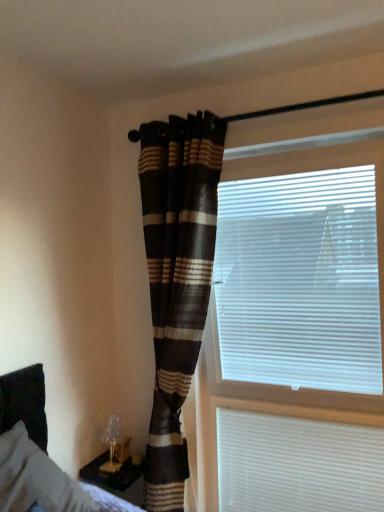
Measure the distance between plaid fabric curtain at center and camera.

plaid fabric curtain at center is 6.37 feet from camera.

Identify the location of white plastic blinds at lower right, the second window blind positioned from the top. (297, 464).

In order to click on gray fabric bed at lower left in this screenshot , I will do `click(38, 449)`.

I want to click on plaid fabric curtain at center, so click(177, 279).

From a real-world perspective, which object stands above the other?

gray fabric bed at lower left, from a real-world perspective.

From the image's perspective, which object appears higher, white plastic blinds at lower right, the second window blind positioned from the top, or gray fabric bed at lower left?

gray fabric bed at lower left.

Does white plastic blinds at lower right, the second window blind positioned from the top, have a smaller size compared to gray fabric bed at lower left?

Yes, white plastic blinds at lower right, the second window blind positioned from the top, is smaller than gray fabric bed at lower left.

Considering the sizes of white plastic blinds at lower right, the second window blind positioned from the top, and gray fabric bed at lower left in the image, is white plastic blinds at lower right, the second window blind positioned from the top, wider or thinner than gray fabric bed at lower left?

Considering their sizes, white plastic blinds at lower right, the second window blind positioned from the top, looks slimmer than gray fabric bed at lower left.

How much distance is there between gray fabric bed at lower left and white plastic blinds at right, which ranks as the first window blind in top-to-bottom order?

gray fabric bed at lower left and white plastic blinds at right, which ranks as the first window blind in top-to-bottom order, are 3.54 feet apart from each other.

From the picture: Is gray fabric bed at lower left situated inside white plastic blinds at right, which ranks as the first window blind in top-to-bottom order, or outside?

gray fabric bed at lower left is spatially situated outside white plastic blinds at right, which ranks as the first window blind in top-to-bottom order.

In the scene shown: Who is taller, gray fabric bed at lower left or white plastic blinds at right, which ranks as the first window blind in top-to-bottom order?

Standing taller between the two is white plastic blinds at right, which ranks as the first window blind in top-to-bottom order.

Could you tell me if gray fabric bed at lower left is facing white plastic blinds at right, which ranks as the first window blind in top-to-bottom order?

No.

Is gray fabric bed at lower left not within white plastic blinds at lower right, the second window blind positioned from the top?

Yes, gray fabric bed at lower left is not within white plastic blinds at lower right, the second window blind positioned from the top.

The width and height of the screenshot is (384, 512). I want to click on window blind that appears below the gray fabric bed at lower left (from the image's perspective), so coord(297,464).

Which object is wider, gray fabric bed at lower left or white plastic blinds at lower right, arranged as the 1th window blind when ordered from the bottom?

gray fabric bed at lower left.

Considering the positions of point (7, 416) and point (243, 429), is point (7, 416) closer or farther from the camera than point (243, 429)?

Point (7, 416).

Which of these two, white plastic blinds at lower right, the second window blind positioned from the top, or plaid fabric curtain at center, is bigger?

plaid fabric curtain at center is bigger.

From the image's perspective, is white plastic blinds at lower right, arranged as the 1th window blind when ordered from the bottom, under plaid fabric curtain at center?

Indeed, from the image's perspective, white plastic blinds at lower right, arranged as the 1th window blind when ordered from the bottom, is shown beneath plaid fabric curtain at center.

Choose the correct answer: Is white plastic blinds at lower right, the second window blind positioned from the top, inside plaid fabric curtain at center or outside it?

white plastic blinds at lower right, the second window blind positioned from the top, is not enclosed by plaid fabric curtain at center.

Can you see white plastic blinds at lower right, the second window blind positioned from the top, touching plaid fabric curtain at center?

white plastic blinds at lower right, the second window blind positioned from the top, and plaid fabric curtain at center are not in contact.

From a real-world perspective, between plaid fabric curtain at center and white plastic blinds at right, which is the 2th window blind in bottom-to-top order, who is vertically lower?

plaid fabric curtain at center.

Who is smaller, plaid fabric curtain at center or white plastic blinds at right, which is the 2th window blind in bottom-to-top order?

Smaller between the two is white plastic blinds at right, which is the 2th window blind in bottom-to-top order.

Is plaid fabric curtain at center at the left side of white plastic blinds at right, which ranks as the first window blind in top-to-bottom order?

Correct, you'll find plaid fabric curtain at center to the left of white plastic blinds at right, which ranks as the first window blind in top-to-bottom order.

Is plaid fabric curtain at center shorter than white plastic blinds at right, which is the 2th window blind in bottom-to-top order?

No.

Is white plastic blinds at right, which is the 2th window blind in bottom-to-top order, aimed at white plastic blinds at lower right, the second window blind positioned from the top?

No, white plastic blinds at right, which is the 2th window blind in bottom-to-top order, is not facing towards white plastic blinds at lower right, the second window blind positioned from the top.

From the image's perspective, is white plastic blinds at right, which is the 2th window blind in bottom-to-top order, under white plastic blinds at lower right, the second window blind positioned from the top?

No, from the image's perspective, white plastic blinds at right, which is the 2th window blind in bottom-to-top order, is not below white plastic blinds at lower right, the second window blind positioned from the top.

Which is closer, (266,375) or (297,450)?

Clearly, point (266,375) is more distant from the camera than point (297,450).

Could you measure the distance between plaid fabric curtain at center and white plastic blinds at lower right, the second window blind positioned from the top?

The distance of plaid fabric curtain at center from white plastic blinds at lower right, the second window blind positioned from the top, is 64.98 centimeters.

Does plaid fabric curtain at center turn towards white plastic blinds at lower right, the second window blind positioned from the top?

No, plaid fabric curtain at center is not oriented towards white plastic blinds at lower right, the second window blind positioned from the top.

Which is more to the left, plaid fabric curtain at center or white plastic blinds at lower right, the second window blind positioned from the top?

plaid fabric curtain at center.

Between plaid fabric curtain at center and white plastic blinds at lower right, arranged as the 1th window blind when ordered from the bottom, which one has smaller width?

With smaller width is white plastic blinds at lower right, arranged as the 1th window blind when ordered from the bottom.

This screenshot has width=384, height=512. In order to click on window blind below the gray fabric bed at lower left (from the image's perspective) in this screenshot , I will do `click(297, 464)`.

You are a GUI agent. You are given a task and a screenshot of the screen. Output one action in this format:
    pyautogui.click(x=<x>, y=<y>)
    Task: Click on the bed in front of the white plastic blinds at right, which ranks as the first window blind in top-to-bottom order
    The image size is (384, 512).
    Given the screenshot: What is the action you would take?
    pyautogui.click(x=38, y=449)

From the picture: From the image, which object appears to be nearer to white plastic blinds at right, which is the 2th window blind in bottom-to-top order, plaid fabric curtain at center or gray fabric bed at lower left?

plaid fabric curtain at center lies closer to white plastic blinds at right, which is the 2th window blind in bottom-to-top order, than the other object.

Considering their positions, is white plastic blinds at lower right, the second window blind positioned from the top, positioned further to gray fabric bed at lower left than white plastic blinds at right, which is the 2th window blind in bottom-to-top order?

white plastic blinds at right, which is the 2th window blind in bottom-to-top order, is further to gray fabric bed at lower left.

Estimate the real-world distances between objects in this image. Which object is closer to white plastic blinds at lower right, the second window blind positioned from the top, plaid fabric curtain at center or gray fabric bed at lower left?

plaid fabric curtain at center.

From the image, which object appears to be farther from plaid fabric curtain at center, white plastic blinds at right, which is the 2th window blind in bottom-to-top order, or white plastic blinds at lower right, the second window blind positioned from the top?

white plastic blinds at lower right, the second window blind positioned from the top, lies further to plaid fabric curtain at center than the other object.

Estimate the real-world distances between objects in this image. Which object is closer to white plastic blinds at lower right, arranged as the 1th window blind when ordered from the bottom, white plastic blinds at right, which is the 2th window blind in bottom-to-top order, or plaid fabric curtain at center?

white plastic blinds at right, which is the 2th window blind in bottom-to-top order.

Based on their spatial positions, is plaid fabric curtain at center or white plastic blinds at right, which ranks as the first window blind in top-to-bottom order, further from white plastic blinds at lower right, arranged as the 1th window blind when ordered from the bottom?

Based on the image, plaid fabric curtain at center appears to be further to white plastic blinds at lower right, arranged as the 1th window blind when ordered from the bottom.

Based on their spatial positions, is gray fabric bed at lower left or white plastic blinds at right, which is the 2th window blind in bottom-to-top order, closer to white plastic blinds at lower right, the second window blind positioned from the top?

Based on the image, white plastic blinds at right, which is the 2th window blind in bottom-to-top order, appears to be nearer to white plastic blinds at lower right, the second window blind positioned from the top.

From the image, which object appears to be nearer to plaid fabric curtain at center, gray fabric bed at lower left or white plastic blinds at right, which ranks as the first window blind in top-to-bottom order?

Among the two, white plastic blinds at right, which ranks as the first window blind in top-to-bottom order, is located nearer to plaid fabric curtain at center.

At what (x,y) coordinates should I click in order to perform the action: click on curtain between gray fabric bed at lower left and white plastic blinds at lower right, the second window blind positioned from the top, in the horizontal direction. Please return your answer as a coordinate pair (x, y). Looking at the image, I should click on (177, 279).

What are the coordinates of `curtain between gray fabric bed at lower left and white plastic blinds at right, which is the 2th window blind in bottom-to-top order, from left to right` in the screenshot? It's located at (177, 279).

The image size is (384, 512). Identify the location of curtain between white plastic blinds at right, which ranks as the first window blind in top-to-bottom order, and white plastic blinds at lower right, arranged as the 1th window blind when ordered from the bottom, in the up-down direction. pos(177,279).

The image size is (384, 512). Identify the location of window blind between gray fabric bed at lower left and white plastic blinds at lower right, arranged as the 1th window blind when ordered from the bottom, from left to right. (300, 273).